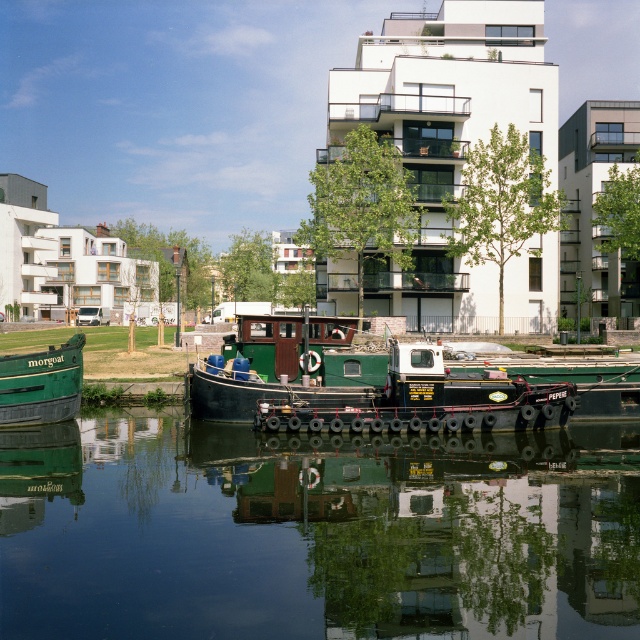
You are a photographer planning to take a photo of both the green matte barge at center and the green matte barge at lower left. Since you want to emphasize their size difference, which barge should you position closer to the camera to make it appear bigger?

To emphasize their size difference, you should position the green matte barge at lower left closer to the camera because it is smaller in actual size than the green matte barge at center. This way, the smaller barge can be magnified in the photo to appear larger relative to the background, highlighting the contrast between their sizes.

You are standing on the grassy area and want to walk to the green matte barge at lower left. Which direction should you go to avoid the black rubber water at center?

The black rubber water at center is closer to you than the green matte barge at lower left, so you should walk towards the lower left direction away from the black rubber water at center to reach the green matte barge at lower left safely.

You are standing at the point with coordinates (316,532) in the urban waterfront scene. What object is located exactly at your current position?

The black rubber water is located exactly at the point with coordinates (316,532).